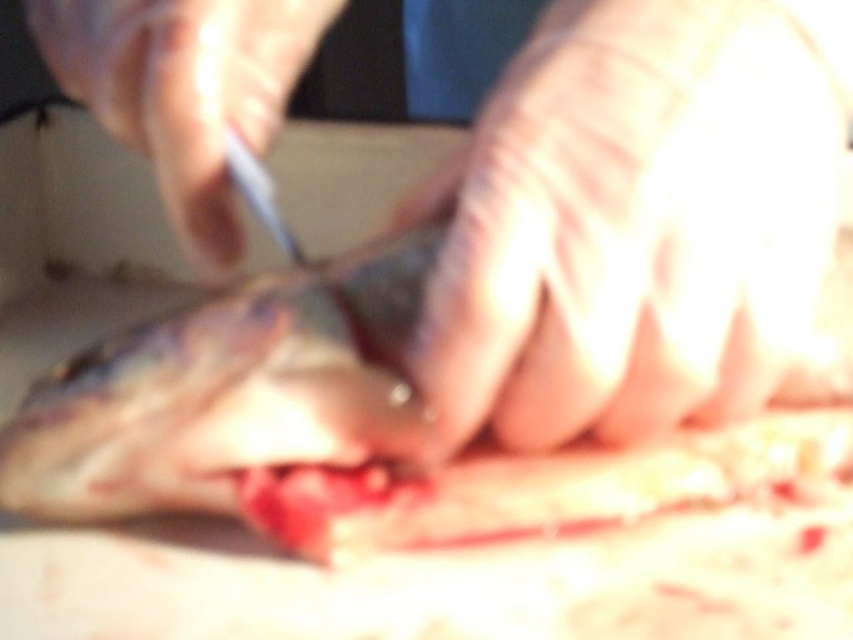
Find the location of a particular element. Image resolution: width=853 pixels, height=640 pixels. flesh-colored skin at center is located at coordinates (637, 218).

Based on the photo, is flesh-colored skin at center positioned before pinkish flesh at center?

Yes, flesh-colored skin at center is closer to the viewer.

Does point (552, 355) come behind point (329, 348)?

No, it is in front of (329, 348).

Find the location of a particular element. This screenshot has height=640, width=853. flesh-colored skin at center is located at coordinates (637, 218).

Between point (196, 502) and point (113, 28), which one is positioned in front?

Positioned in front is point (196, 502).

Locate an element on the screen. Image resolution: width=853 pixels, height=640 pixels. pinkish flesh at center is located at coordinates tap(227, 392).

Which is behind, point (152, 467) or point (242, 44)?

Point (242, 44)

The image size is (853, 640). What are the coordinates of `pinkish flesh at center` in the screenshot? It's located at (227, 392).

Does flesh-colored skin at center have a larger size compared to gloved hand at upper center?

Incorrect, flesh-colored skin at center is not larger than gloved hand at upper center.

Consider the image. Who is more distant from viewer, (592, 112) or (132, 134)?

Point (132, 134)

This screenshot has width=853, height=640. What do you see at coordinates (637, 218) in the screenshot?
I see `flesh-colored skin at center` at bounding box center [637, 218].

Where is `flesh-colored skin at center`? flesh-colored skin at center is located at coordinates (637, 218).